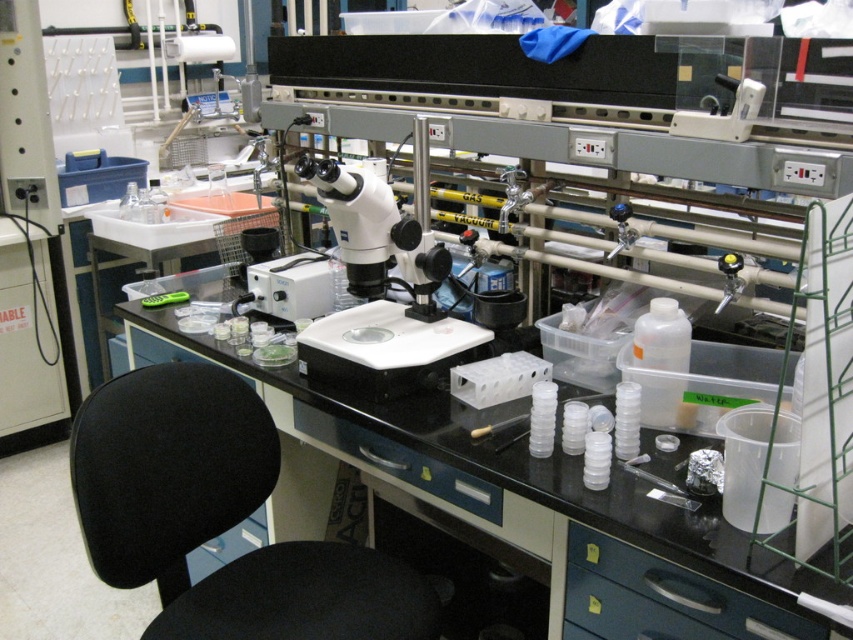
Does black fabric stool at lower left appear on the right side of black plastic drawer at lower right?

No, black fabric stool at lower left is not to the right of black plastic drawer at lower right.

Identify the location of black fabric stool at lower left. (305, 596).

In order to click on black fabric stool at lower left in this screenshot , I will do `click(305, 596)`.

I want to click on black fabric stool at lower left, so click(305, 596).

The width and height of the screenshot is (853, 640). What do you see at coordinates (381, 292) in the screenshot? I see `white plastic microscope at center` at bounding box center [381, 292].

Consider the image. Is white plastic microscope at center shorter than black fabric stool at lower left?

Incorrect, white plastic microscope at center's height does not fall short of black fabric stool at lower left's.

At what (x,y) coordinates should I click in order to perform the action: click on white plastic microscope at center. Please return your answer as a coordinate pair (x, y). This screenshot has height=640, width=853. Looking at the image, I should click on (381, 292).

Is point (315, 182) farther from camera compared to point (708, 628)?

Yes, it is behind point (708, 628).

Measure the distance between white plastic microscope at center and camera.

They are 1.51 meters apart.

Is point (375, 348) closer to camera compared to point (643, 561)?

No, it is not.

You are a GUI agent. You are given a task and a screenshot of the screen. Output one action in this format:
    pyautogui.click(x=<x>, y=<y>)
    Task: Click on the white plastic microscope at center
    The image size is (853, 640).
    Given the screenshot: What is the action you would take?
    pyautogui.click(x=381, y=292)